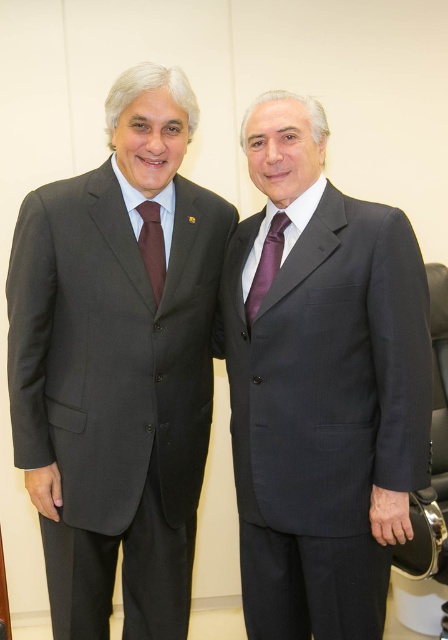
You are a photographer setting up for a formal event. You need to position a light source to the right of the matte black suit at left and to the left of the brown silk tie at left. Is this possible given their positions?

The matte black suit at left is to the left of the brown silk tie at left. Therefore, placing a light source to the right of the matte black suit at left and to the left of the brown silk tie at left is possible since the brown silk tie at left is positioned to the right of the matte black suit at left.

You are a tailor who needs to determine the correct measurements for the matte black suit at left and the brown silk tie at left. Based on the image, which item requires a larger measurement for its size?

The matte black suit at left requires a larger measurement because it has a larger size compared to the brown silk tie at left.